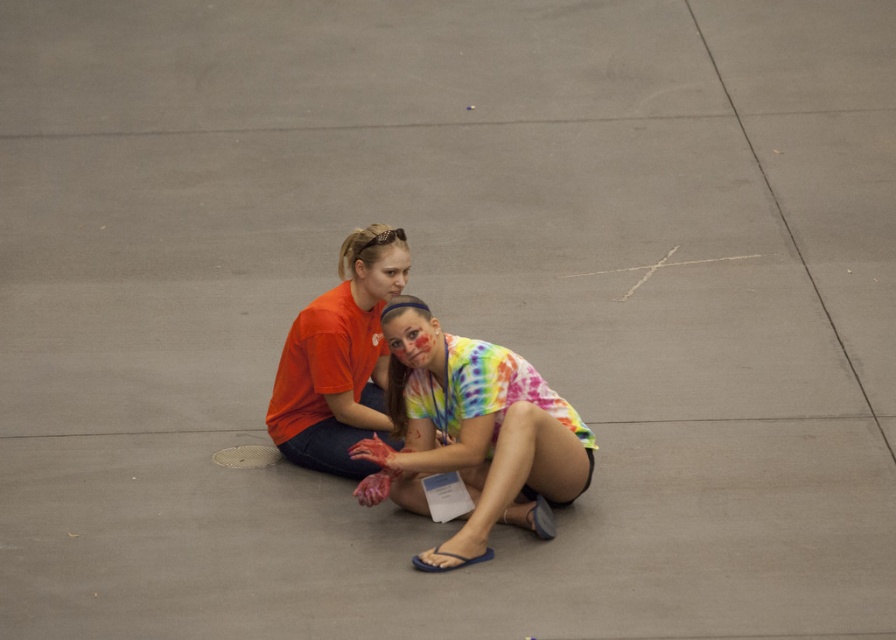
Does tie-dye fabric shirt at center have a greater width compared to matte orange t-shirt at center?

Yes.

Which is behind, point (444, 378) or point (351, 289)?

The point (351, 289) is behind.

Is point (424, 570) closer to viewer compared to point (334, 362)?

Yes.

Locate an element on the screen. tie-dye fabric shirt at center is located at coordinates (472, 433).